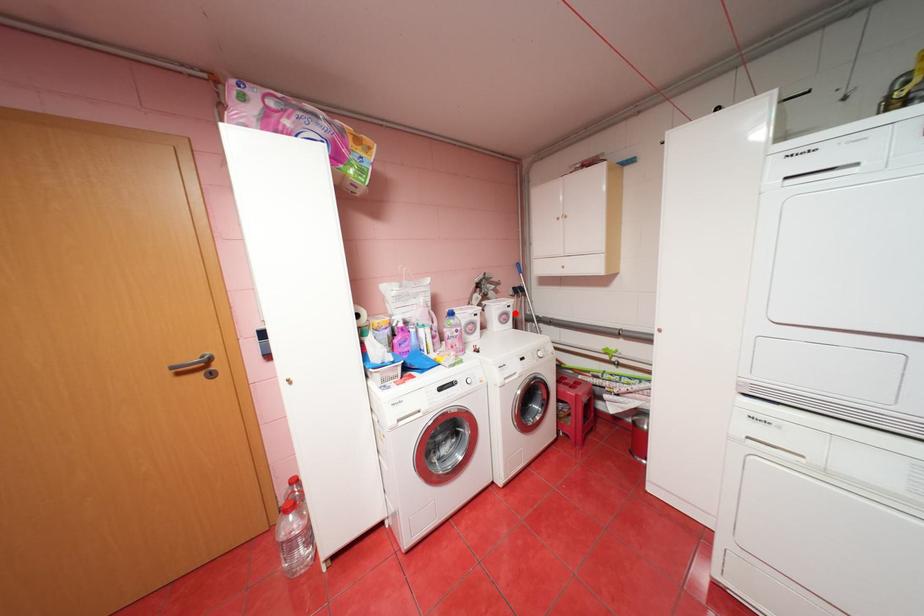
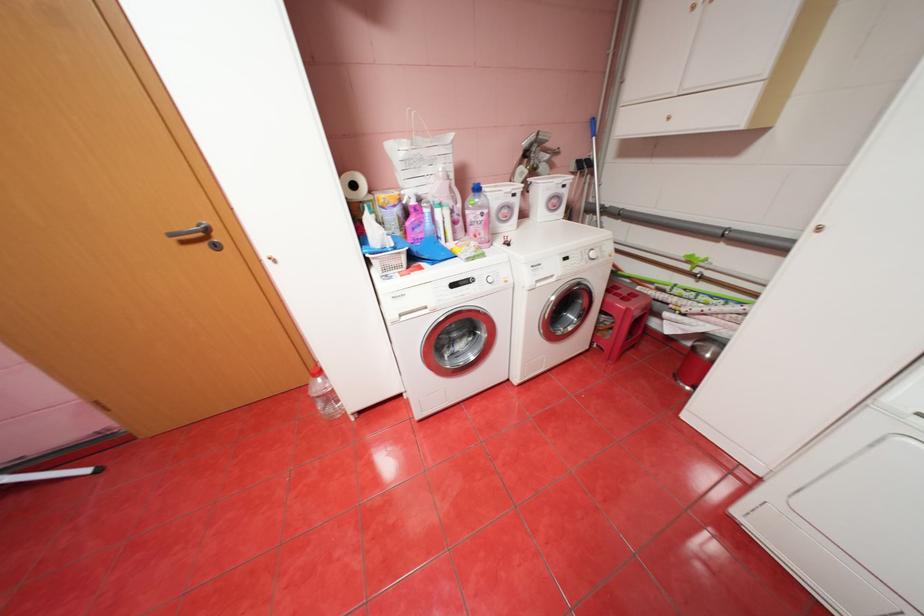
Find the pixel in the second image that matches the highlighted location in the first image.

(566, 197)